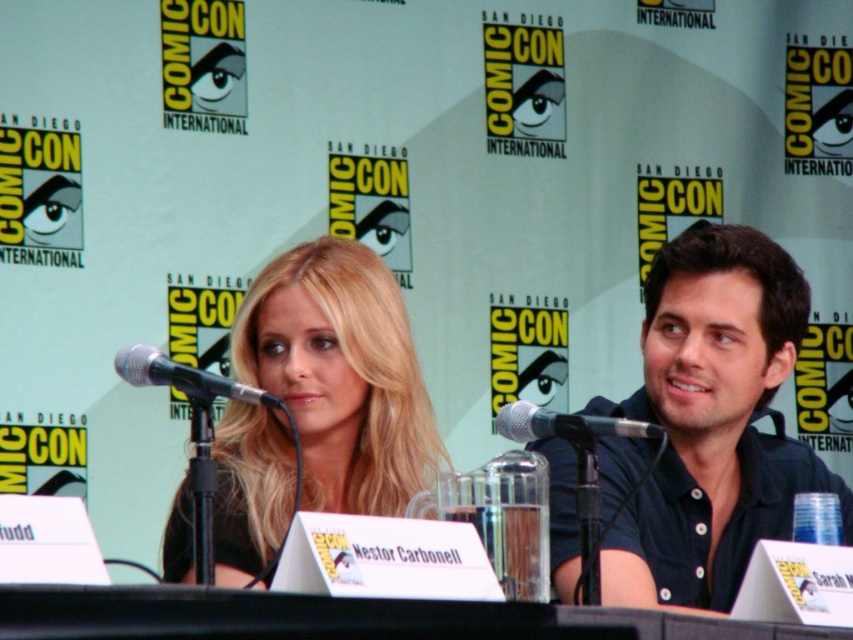
You are a photographer at Comic Con trying to capture a closeup of the black metallic microphone at left and the silver metallic microphone at center. Which microphone is positioned more to the left side?

The black metallic microphone at left is positioned on the left side of the silver metallic microphone at center, so it is more to the left.